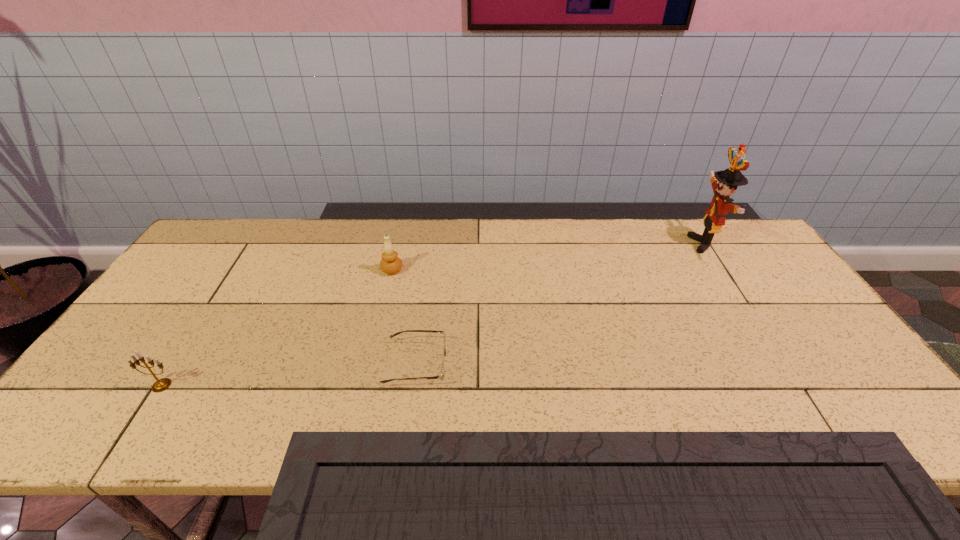
Where is `vacant space located on the front-facing side of the rightmost object`? vacant space located on the front-facing side of the rightmost object is located at coordinates (579, 244).

At what (x,y) coordinates should I click in order to perform the action: click on vacant space situated 0.110m on the right of the farther candelabrum. Please return your answer as a coordinate pair (x, y). Image resolution: width=960 pixels, height=540 pixels. Looking at the image, I should click on (440, 270).

Where is `free space located 0.090m on the right of the left candelabrum`? The height and width of the screenshot is (540, 960). free space located 0.090m on the right of the left candelabrum is located at coordinates (216, 386).

Find the location of `vacant space located 0.130m on the front-facing side of the spectacles`. vacant space located 0.130m on the front-facing side of the spectacles is located at coordinates (500, 364).

The height and width of the screenshot is (540, 960). Identify the location of nutcracker that is at the far edge. (724, 183).

This screenshot has height=540, width=960. I want to click on candle_holder positioned at the far edge, so click(x=390, y=264).

I want to click on object situated at the left edge, so click(160, 385).

At what (x,y) coordinates should I click in order to perform the action: click on object that is at the right edge. Please return your answer as a coordinate pair (x, y). The width and height of the screenshot is (960, 540). Looking at the image, I should click on (724, 183).

Identify the location of object that is positioned at the far right corner. This screenshot has width=960, height=540. (724, 183).

Identify the location of free space at the far edge of the desktop. Image resolution: width=960 pixels, height=540 pixels. (488, 254).